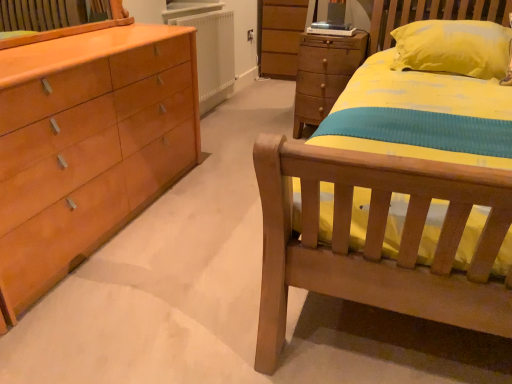
From the picture: What is the approximate height of wooden chest of drawers at center?

wooden chest of drawers at center is 73.95 centimeters tall.

What do you see at coordinates (324, 74) in the screenshot?
I see `wooden chest of drawers at center` at bounding box center [324, 74].

The width and height of the screenshot is (512, 384). In order to click on wooden chest of drawers at center in this screenshot , I will do `click(324, 74)`.

What is the approximate height of white matte radiator at center?

The height of white matte radiator at center is 66.01 centimeters.

Consider the image. Measure the distance between point (225, 49) and camera.

They are 11.42 feet apart.

What do you see at coordinates (211, 53) in the screenshot?
I see `white matte radiator at center` at bounding box center [211, 53].

At what (x,y) coordinates should I click in order to perform the action: click on white matte radiator at center. Please return your answer as a coordinate pair (x, y). The height and width of the screenshot is (384, 512). Looking at the image, I should click on (211, 53).

Where is `wooden chest of drawers at center`? wooden chest of drawers at center is located at coordinates (324, 74).

Between white matte radiator at center and wooden chest of drawers at center, which one appears on the left side from the viewer's perspective?

From the viewer's perspective, white matte radiator at center appears more on the left side.

Which object is closer to the camera, white matte radiator at center or wooden chest of drawers at center?

wooden chest of drawers at center is in front.

Is point (207, 68) farther from camera compared to point (305, 90)?

Yes, it is.

From the image's perspective, is white matte radiator at center located beneath wooden chest of drawers at center?

No, from the image's perspective, white matte radiator at center is not beneath wooden chest of drawers at center.

From a real-world perspective, between white matte radiator at center and wooden chest of drawers at center, who is vertically higher?

In real-world perspective, white matte radiator at center is above.

Does white matte radiator at center have a lesser width compared to wooden chest of drawers at center?

Correct, the width of white matte radiator at center is less than that of wooden chest of drawers at center.

Can you confirm if white matte radiator at center is taller than wooden chest of drawers at center?

No.

Which of these two, white matte radiator at center or wooden chest of drawers at center, is smaller?

With smaller size is white matte radiator at center.

Would you say white matte radiator at center is outside wooden chest of drawers at center?

Yes, white matte radiator at center is not within wooden chest of drawers at center.

Is white matte radiator at center with wooden chest of drawers at center?

No.

Does white matte radiator at center turn towards wooden chest of drawers at center?

Yes, white matte radiator at center is turned towards wooden chest of drawers at center.

What's the angular difference between white matte radiator at center and wooden chest of drawers at center's facing directions?

They differ by 91.8 degrees in their facing directions.

Measure the distance from white matte radiator at center to wooden chest of drawers at center.

white matte radiator at center and wooden chest of drawers at center are 36.16 inches apart from each other.

Locate an element on the screen. Image resolution: width=512 pixels, height=384 pixels. radiator that is behind the wooden chest of drawers at center is located at coordinates (211, 53).

Can you confirm if wooden chest of drawers at center is positioned to the left of white matte radiator at center?

No, wooden chest of drawers at center is not to the left of white matte radiator at center.

Considering the positions of objects wooden chest of drawers at center and white matte radiator at center in the image provided, who is behind, wooden chest of drawers at center or white matte radiator at center?

white matte radiator at center.

Between point (298, 95) and point (221, 32), which one is positioned behind?

The point (221, 32) is farther.

From the image's perspective, between wooden chest of drawers at center and white matte radiator at center, which one is located above?

white matte radiator at center.

From a real-world perspective, relative to white matte radiator at center, is wooden chest of drawers at center vertically above or below?

wooden chest of drawers at center is below white matte radiator at center.

Is wooden chest of drawers at center wider or thinner than white matte radiator at center?

In the image, wooden chest of drawers at center appears to be wider than white matte radiator at center.

Is wooden chest of drawers at center taller or shorter than white matte radiator at center?

In the image, wooden chest of drawers at center appears to be taller than white matte radiator at center.

Does wooden chest of drawers at center have a smaller size compared to white matte radiator at center?

No, wooden chest of drawers at center is not smaller than white matte radiator at center.

Is wooden chest of drawers at center not within white matte radiator at center?

Indeed, wooden chest of drawers at center is completely outside white matte radiator at center.

Is wooden chest of drawers at center beside white matte radiator at center?

No, wooden chest of drawers at center is not touching white matte radiator at center.

Does wooden chest of drawers at center turn towards white matte radiator at center?

No.

How many degrees apart are the facing directions of wooden chest of drawers at center and white matte radiator at center?

They differ by 91.8 degrees in their facing directions.

You are a GUI agent. You are given a task and a screenshot of the screen. Output one action in this format:
    pyautogui.click(x=<x>, y=<y>)
    Task: Click on the chest of drawers that appears in front of the white matte radiator at center
    Image resolution: width=512 pixels, height=384 pixels.
    Given the screenshot: What is the action you would take?
    pyautogui.click(x=324, y=74)

This screenshot has height=384, width=512. What are the coordinates of `radiator on the left of wooden chest of drawers at center` in the screenshot? It's located at [x=211, y=53].

The width and height of the screenshot is (512, 384). Find the location of `radiator above the wooden chest of drawers at center (from the image's perspective)`. radiator above the wooden chest of drawers at center (from the image's perspective) is located at coordinates (211, 53).